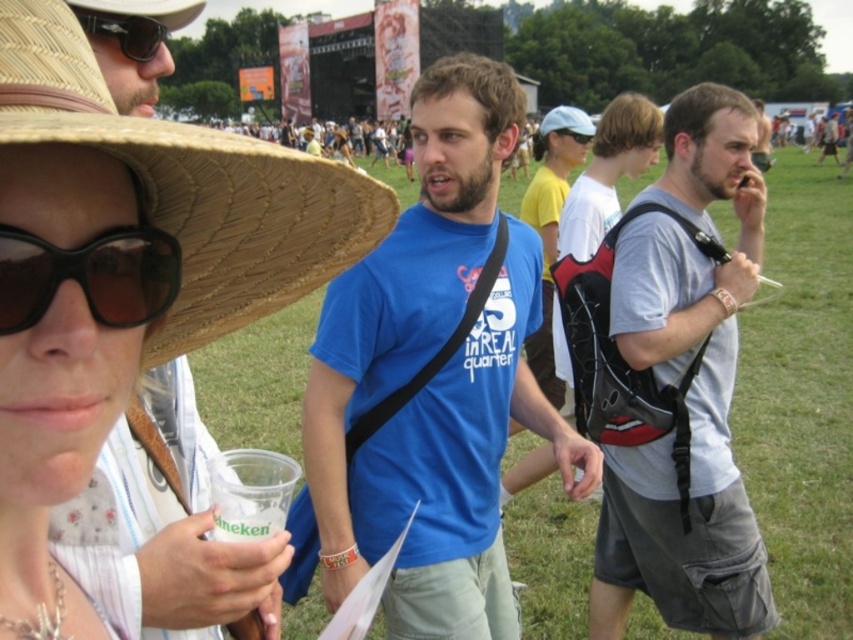
You are a photographer at the festival and want to take a photo of the black matte goggles at center and the matte black sunglasses at upper left. Which object should you focus on first if you want to capture both in the same frame without moving the camera?

The black matte goggles at center is positioned under the matte black sunglasses at upper left, so you should focus on the matte black sunglasses at upper left first to ensure both are in the frame.